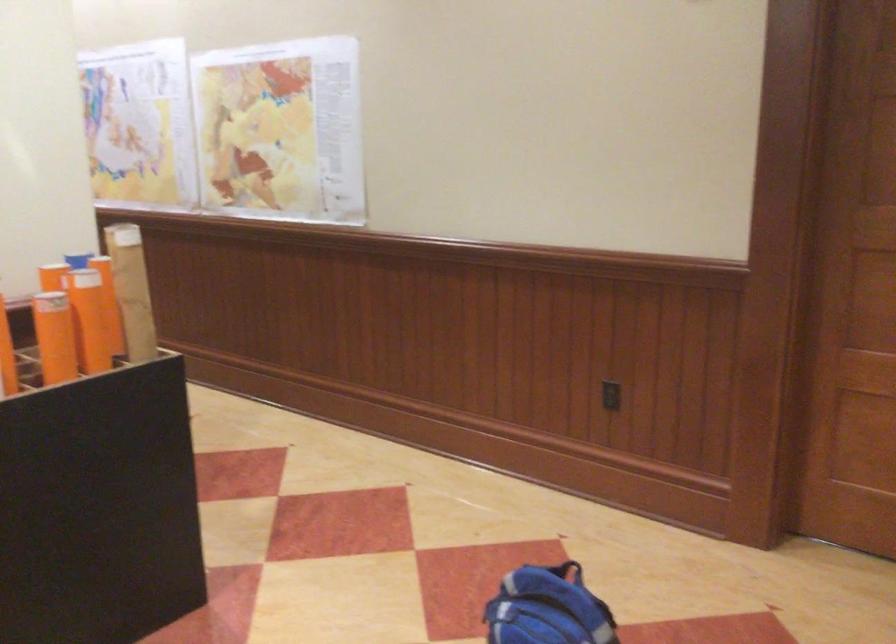
This screenshot has width=896, height=644. What are the coordinates of `black electrical outlet` in the screenshot? It's located at (609, 395).